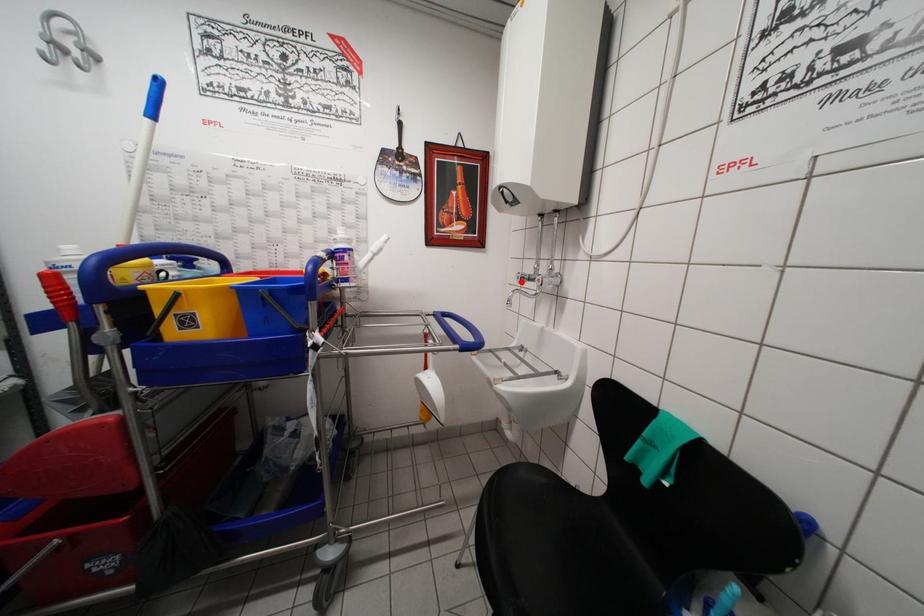
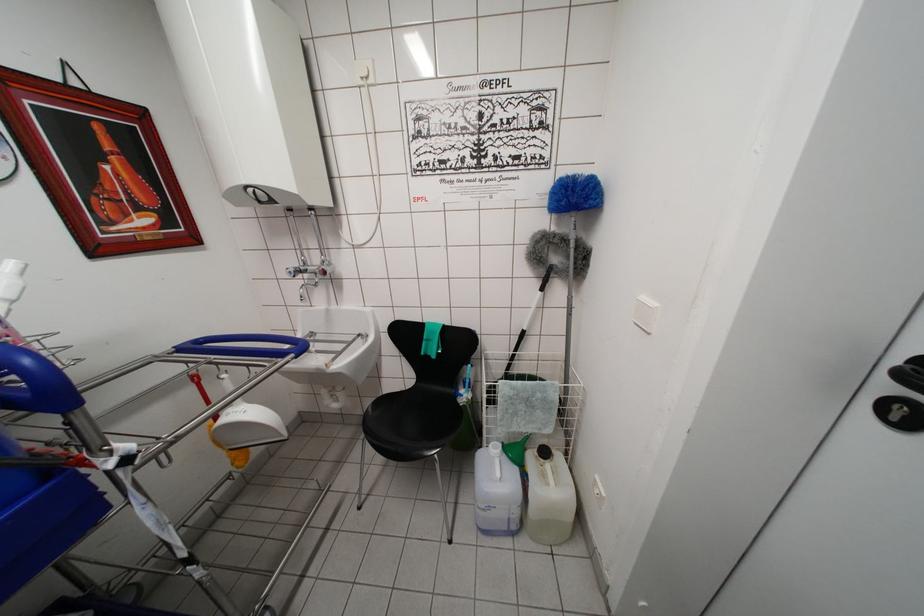
In the second image, find the point that corresponds to the highlighted location in the first image.

(293, 277)